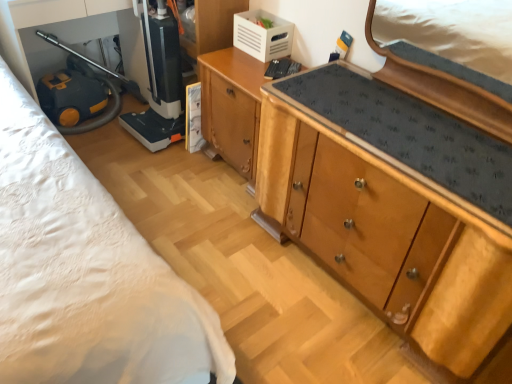
Question: Is black plastic vacuum cleaner at lower left, acting as the 1th appliance starting from the left, thinner than wooden cabinet at center, arranged as the 2th cabinetry when viewed from the right?

Choices:
 (A) no
 (B) yes

Answer: (B)

Question: From the image's perspective, would you say black plastic vacuum cleaner at lower left, acting as the 1th appliance starting from the left, is shown under wooden cabinet at center, arranged as the 2th cabinetry when viewed from the right?

Choices:
 (A) no
 (B) yes

Answer: (A)

Question: Is black plastic vacuum cleaner at lower left, the 2th appliance in the right-to-left sequence, oriented away from wooden cabinet at center, arranged as the 1th cabinetry when viewed from the left?

Choices:
 (A) yes
 (B) no

Answer: (B)

Question: From the image's perspective, is black plastic vacuum cleaner at lower left, the 2th appliance in the right-to-left sequence, over wooden cabinet at center, arranged as the 1th cabinetry when viewed from the left?

Choices:
 (A) yes
 (B) no

Answer: (A)

Question: Would you say black plastic vacuum cleaner at lower left, the 2th appliance in the right-to-left sequence, contains wooden cabinet at center, arranged as the 1th cabinetry when viewed from the left?

Choices:
 (A) no
 (B) yes

Answer: (A)

Question: From a real-world perspective, relative to wooden cabinet at center, arranged as the 1th cabinetry when viewed from the left, is wooden cabinet at center, which appears as the 1th cabinetry when viewed from the right, vertically above or below?

Choices:
 (A) above
 (B) below

Answer: (A)

Question: Is point (349, 253) positioned closer to the camera than point (237, 49)?

Choices:
 (A) closer
 (B) farther

Answer: (A)

Question: Based on their sizes in the image, would you say wooden cabinet at center, which appears as the 1th cabinetry when viewed from the right, is bigger or smaller than wooden cabinet at center, arranged as the 2th cabinetry when viewed from the right?

Choices:
 (A) small
 (B) big

Answer: (B)

Question: Which is correct: wooden cabinet at center, placed as the 2th cabinetry when sorted from left to right, is inside wooden cabinet at center, arranged as the 1th cabinetry when viewed from the left, or outside of it?

Choices:
 (A) outside
 (B) inside

Answer: (A)

Question: In terms of width, does white plastic crate at upper center, the 1th appliance positioned from the right, look wider or thinner when compared to wooden cabinet at center, which appears as the 1th cabinetry when viewed from the right?

Choices:
 (A) thin
 (B) wide

Answer: (A)

Question: Choose the correct answer: Is white plastic crate at upper center, which is counted as the 2th appliance, starting from the left, inside wooden cabinet at center, which appears as the 1th cabinetry when viewed from the right, or outside it?

Choices:
 (A) inside
 (B) outside

Answer: (B)

Question: From the image's perspective, is white plastic crate at upper center, the 1th appliance positioned from the right, located above or below wooden cabinet at center, which appears as the 1th cabinetry when viewed from the right?

Choices:
 (A) above
 (B) below

Answer: (A)

Question: From a real-world perspective, is white plastic crate at upper center, the 1th appliance positioned from the right, positioned above or below wooden cabinet at center, placed as the 2th cabinetry when sorted from left to right?

Choices:
 (A) below
 (B) above

Answer: (B)

Question: Is wooden cabinet at center, arranged as the 1th cabinetry when viewed from the left, in front of or behind wooden cabinet at center, which appears as the 1th cabinetry when viewed from the right, in the image?

Choices:
 (A) front
 (B) behind

Answer: (B)

Question: Considering the positions of point (231, 109) and point (264, 180), is point (231, 109) closer or farther from the camera than point (264, 180)?

Choices:
 (A) closer
 (B) farther

Answer: (B)